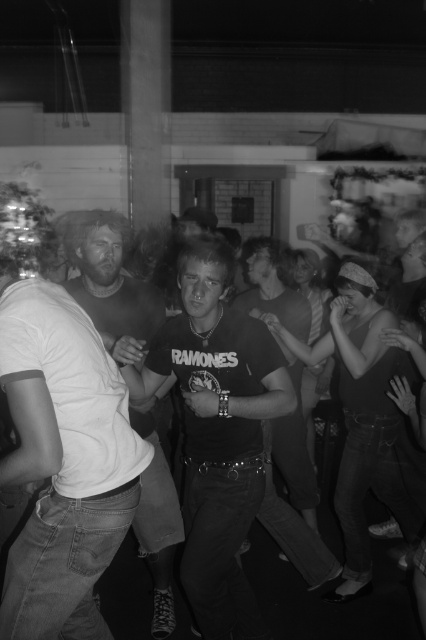
Is matte black t-shirt at center smaller than matte white shirt at center?

Incorrect, matte black t-shirt at center is not smaller in size than matte white shirt at center.

Can you confirm if matte black t-shirt at center is taller than matte white shirt at center?

Indeed, matte black t-shirt at center has a greater height compared to matte white shirt at center.

At what (x,y) coordinates should I click in order to perform the action: click on matte black t-shirt at center. Please return your answer as a coordinate pair (x, y). Image resolution: width=426 pixels, height=640 pixels. Looking at the image, I should click on (218, 429).

Can you confirm if matte black t-shirt at center is positioned to the left of dark gray t-shirt at center?

Yes, matte black t-shirt at center is to the left of dark gray t-shirt at center.

Between matte black t-shirt at center and dark gray t-shirt at center, which one is positioned lower?

matte black t-shirt at center

The image size is (426, 640). What do you see at coordinates (218, 429) in the screenshot?
I see `matte black t-shirt at center` at bounding box center [218, 429].

The height and width of the screenshot is (640, 426). I want to click on matte black t-shirt at center, so click(218, 429).

Is matte white shirt at center wider than dark gray t-shirt at center?

Incorrect, matte white shirt at center's width does not surpass dark gray t-shirt at center's.

What do you see at coordinates (108, 276) in the screenshot? I see `matte white shirt at center` at bounding box center [108, 276].

Is point (152, 496) positioned before point (307, 317)?

Yes.

I want to click on matte white shirt at center, so click(x=108, y=276).